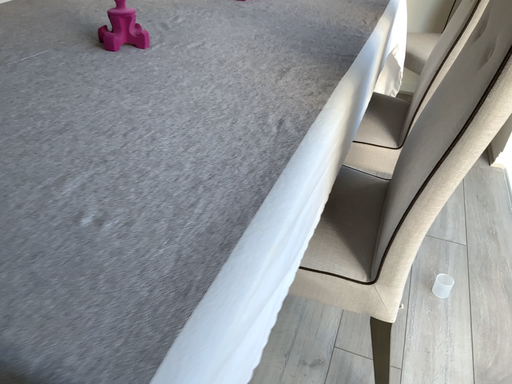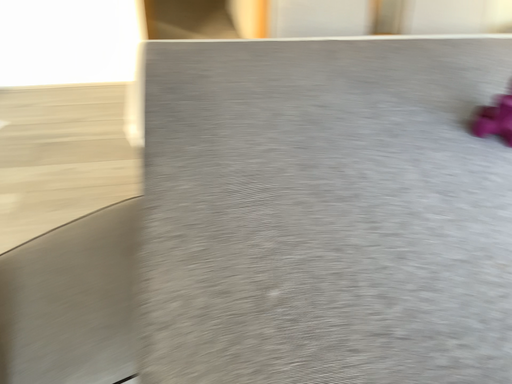
Question: Which way did the camera rotate in the video?

Choices:
 (A) rotated upward
 (B) rotated downward

Answer: (A)